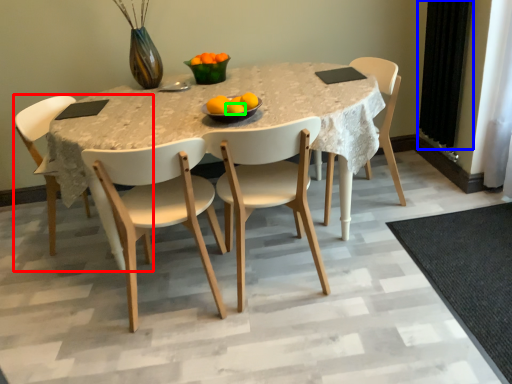
Question: Based on their relative distances, which object is farther from chair (highlighted by a red box)? Choose from curtain (highlighted by a blue box) and orange (highlighted by a green box).

Choices:
 (A) curtain
 (B) orange

Answer: (A)